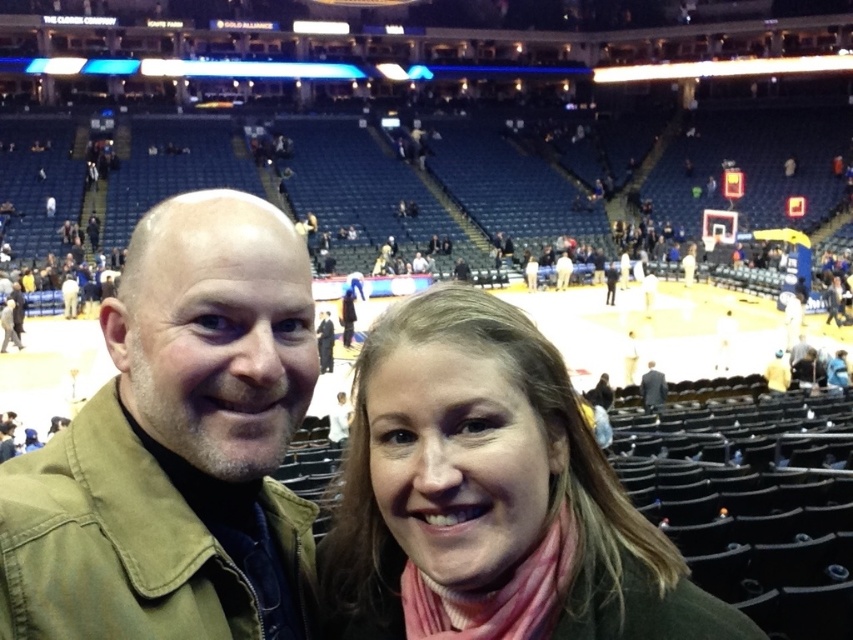
You are a photographer standing at the back of the arena. You want to take a photo of both the khaki cotton jacket at left and the dark gray suit at center in the same frame. Given that your camera has a maximum zoom range of 20 meters, can you capture both subjects in a single shot without moving closer?

The distance between the khaki cotton jacket at left and the dark gray suit at center is 21.99 meters, which exceeds the camera maximum zoom range of 20 meters. Therefore, you cannot capture both subjects in a single shot without moving closer.

You are a photographer trying to capture a wide shot of the khaki cotton jacket at left and the pink wool scarf at center. Which object should you zoom in on to ensure both fit in the frame without cropping?

You should zoom in on the khaki cotton jacket at left because its width is smaller than the pink wool scarf at center, allowing both to fit within the frame when focusing on the narrower object.